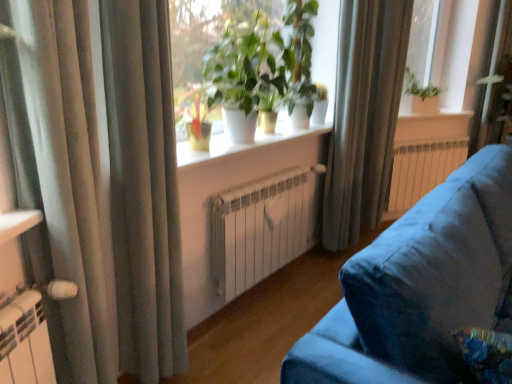
What do you see at coordinates (300, 54) in the screenshot? I see `green glossy plant at upper center` at bounding box center [300, 54].

The width and height of the screenshot is (512, 384). What do you see at coordinates (143, 188) in the screenshot?
I see `silky gray curtain at left, which is the second curtain in left-to-right order` at bounding box center [143, 188].

The width and height of the screenshot is (512, 384). I want to click on white metallic radiator at center, which appears as the first radiator when viewed from the right, so click(x=422, y=170).

At what (x,y) coordinates should I click in order to perform the action: click on white glossy pot at center. Please return your answer as a coordinate pair (x, y). Looking at the image, I should click on (264, 69).

Would you say silky gray curtain at left, the second curtain in the back-to-front sequence, is inside or outside velvet blue couch at lower right?

silky gray curtain at left, the second curtain in the back-to-front sequence, exists outside the volume of velvet blue couch at lower right.

Is silky gray curtain at left, placed as the second curtain when sorted from right to left, aimed at velvet blue couch at lower right?

Yes, silky gray curtain at left, placed as the second curtain when sorted from right to left, is oriented towards velvet blue couch at lower right.

In terms of width, does silky gray curtain at left, the 2th curtain from the front, look wider or thinner when compared to velvet blue couch at lower right?

In the image, silky gray curtain at left, the 2th curtain from the front, appears to be more narrow than velvet blue couch at lower right.

Considering the sizes of white metallic radiator at center, which is the second radiator in right-to-left order, and satin fabric curtain at left, marked as the 1th curtain in a front-to-back arrangement, in the image, is white metallic radiator at center, which is the second radiator in right-to-left order, wider or thinner than satin fabric curtain at left, marked as the 1th curtain in a front-to-back arrangement,?

In the image, white metallic radiator at center, which is the second radiator in right-to-left order, appears to be more narrow than satin fabric curtain at left, marked as the 1th curtain in a front-to-back arrangement.

Does white metallic radiator at center, acting as the first radiator starting from the front, turn towards satin fabric curtain at left, which is counted as the 3th curtain, starting from the back?

No.

Considering the points (302, 224) and (15, 45), which point is behind, point (302, 224) or point (15, 45)?

The point (302, 224) is behind.

From a real-world perspective, which object stands above the other?

satin fabric curtain at left, which is counted as the third curtain, starting from the right, from a real-world perspective.

Is white glossy pot at center thinner than white glossy window sill at center, which is counted as the second window sill, starting from the bottom?

In fact, white glossy pot at center might be wider than white glossy window sill at center, which is counted as the second window sill, starting from the bottom.

Could you tell me if white glossy pot at center is facing white glossy window sill at center, which is counted as the second window sill, starting from the bottom?

No, white glossy pot at center does not turn towards white glossy window sill at center, which is counted as the second window sill, starting from the bottom.

From a real-world perspective, is white glossy pot at center physically located above or below white glossy window sill at center, positioned as the first window sill in top-to-bottom order?

white glossy pot at center is above white glossy window sill at center, positioned as the first window sill in top-to-bottom order.

Would you consider white glossy pot at center to be distant from white glossy window sill at center, positioned as the first window sill in top-to-bottom order?

Absolutely, white glossy pot at center is distant from white glossy window sill at center, positioned as the first window sill in top-to-bottom order.

From a real-world perspective, is white metallic radiator at center, acting as the first radiator starting from the front, located beneath velvet blue couch at lower right?

Yes, from a real-world perspective, white metallic radiator at center, acting as the first radiator starting from the front, is below velvet blue couch at lower right.

Considering the positions of points (246, 251) and (472, 326), is point (246, 251) closer to camera compared to point (472, 326)?

No, it is not.

Is white metallic radiator at center, which is the second radiator in right-to-left order, at the right side of velvet blue couch at lower right?

No, white metallic radiator at center, which is the second radiator in right-to-left order, is not to the right of velvet blue couch at lower right.

Is point (141, 7) closer to viewer compared to point (334, 163)?

Yes, it is.

From the image's perspective, which is below, silky gray curtain at left, placed as the second curtain when sorted from right to left, or silky gray curtain at upper right, marked as the 1th curtain in a back-to-front arrangement?

silky gray curtain at left, placed as the second curtain when sorted from right to left, appears lower in the image.

Is silky gray curtain at left, placed as the second curtain when sorted from right to left, looking in the opposite direction of silky gray curtain at upper right, which appears as the third curtain when viewed from the front?

No, silky gray curtain at left, placed as the second curtain when sorted from right to left,'s orientation is not away from silky gray curtain at upper right, which appears as the third curtain when viewed from the front.

Is point (344, 48) positioned after point (289, 37)?

That is False.

From their relative heights in the image, would you say silky gray curtain at upper right, placed as the 3th curtain when sorted from left to right, is taller or shorter than green glossy plant at upper center?

Clearly, silky gray curtain at upper right, placed as the 3th curtain when sorted from left to right, is taller compared to green glossy plant at upper center.

How different are the orientations of silky gray curtain at upper right, placed as the 3th curtain when sorted from left to right, and green glossy plant at upper center in degrees?

There is a 0.444-degree angle between the facing directions of silky gray curtain at upper right, placed as the 3th curtain when sorted from left to right, and green glossy plant at upper center.

Looking at this image, is white glossy pot at center at the back of velvet blue couch at lower right?

velvet blue couch at lower right is not turned away from white glossy pot at center.

Are velvet blue couch at lower right and white glossy pot at center located far from each other?

Yes, velvet blue couch at lower right and white glossy pot at center are located far from each other.

Where is `houseplant above the velvet blue couch at lower right (from a real-world perspective)`? The height and width of the screenshot is (384, 512). houseplant above the velvet blue couch at lower right (from a real-world perspective) is located at coordinates (264, 69).

Is point (399, 381) behind point (245, 68)?

No, it is in front of (245, 68).

In the image, there is a silky gray curtain at left, placed as the second curtain when sorted from right to left. Identify the location of studio couch below it (from a real-world perspective). (418, 286).

Identify the location of radiator that is the 1st object to the right of the satin fabric curtain at left, the first curtain from the left, starting at the anchor. The image size is (512, 384). (262, 228).

From the image, which object appears to be nearer to white metallic radiator at center, which ranks as the 1th radiator in back-to-front order, white glossy window sill at center, arranged as the 1th window sill when viewed from the right, or white glossy window sill at center, the 1th window sill positioned from the front?

The object closer to white metallic radiator at center, which ranks as the 1th radiator in back-to-front order, is white glossy window sill at center, arranged as the 1th window sill when viewed from the right.

When comparing their distances from white metallic radiator at center, acting as the second radiator starting from the front, does satin fabric curtain at left, which is counted as the third curtain, starting from the right, or white glossy window sill at center, which is the 2th window sill in back-to-front order, seem further?

satin fabric curtain at left, which is counted as the third curtain, starting from the right, is further to white metallic radiator at center, acting as the second radiator starting from the front.

From the image, which object appears to be farther from white glossy pot at center, white metallic radiator at center, acting as the second radiator starting from the front, or white glossy window sill at center, which is the 1th window sill in bottom-to-top order?

Among the two, white metallic radiator at center, acting as the second radiator starting from the front, is located further to white glossy pot at center.

Considering their positions, is white glossy window sill at center, positioned as the first window sill in top-to-bottom order, positioned closer to white metallic radiator at center, the 1th radiator viewed from the left, than silky gray curtain at left, placed as the second curtain when sorted from right to left?

silky gray curtain at left, placed as the second curtain when sorted from right to left, lies closer to white metallic radiator at center, the 1th radiator viewed from the left, than the other object.

Estimate the real-world distances between objects in this image. Which object is further from white glossy pot at center, white metallic radiator at center, the 1th radiator viewed from the left, or green glossy plant at upper center?

The object further to white glossy pot at center is white metallic radiator at center, the 1th radiator viewed from the left.

From the image, which object appears to be farther from satin fabric curtain at left, which is counted as the third curtain, starting from the right, white metallic radiator at center, which is the second radiator in right-to-left order, or white glossy window sill at center, the 1th window sill positioned from the front?

The object further to satin fabric curtain at left, which is counted as the third curtain, starting from the right, is white metallic radiator at center, which is the second radiator in right-to-left order.

Estimate the real-world distances between objects in this image. Which object is closer to velvet blue couch at lower right, silky gray curtain at upper right, which appears as the third curtain when viewed from the front, or white glossy window sill at center, acting as the 1th window sill starting from the back?

silky gray curtain at upper right, which appears as the third curtain when viewed from the front.

Looking at the image, which one is located further to satin fabric curtain at left, marked as the 1th curtain in a front-to-back arrangement, white glossy window sill at center, positioned as the first window sill in top-to-bottom order, or velvet blue couch at lower right?

white glossy window sill at center, positioned as the first window sill in top-to-bottom order, is positioned further to the anchor satin fabric curtain at left, marked as the 1th curtain in a front-to-back arrangement.

You are a GUI agent. You are given a task and a screenshot of the screen. Output one action in this format:
    pyautogui.click(x=<x>, y=<y>)
    Task: Click on the curtain located between silky gray curtain at left, the second curtain in the back-to-front sequence, and white glossy window sill at center, which is counted as the second window sill, starting from the bottom, in the depth direction
    The height and width of the screenshot is (384, 512).
    Given the screenshot: What is the action you would take?
    pyautogui.click(x=364, y=116)

The image size is (512, 384). I want to click on window sill located between velvet blue couch at lower right and green glossy plant at upper center in the depth direction, so click(x=242, y=144).

Where is `radiator between satin fabric curtain at left, which is counted as the 3th curtain, starting from the back, and white metallic radiator at center, the 2th radiator positioned from the left, along the z-axis`? This screenshot has height=384, width=512. radiator between satin fabric curtain at left, which is counted as the 3th curtain, starting from the back, and white metallic radiator at center, the 2th radiator positioned from the left, along the z-axis is located at coordinates (262, 228).

Where is `vegetation between velvet blue couch at lower right and white metallic radiator at center, which appears as the first radiator when viewed from the right, from front to back`? The width and height of the screenshot is (512, 384). vegetation between velvet blue couch at lower right and white metallic radiator at center, which appears as the first radiator when viewed from the right, from front to back is located at coordinates (300, 54).